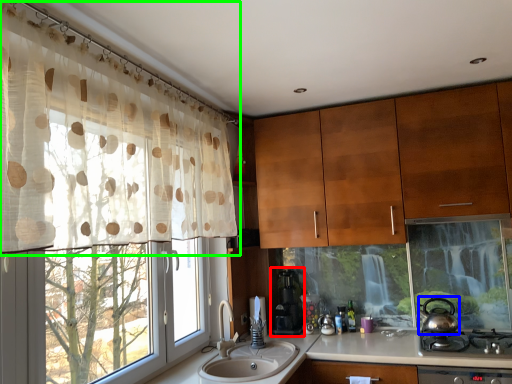
Question: Estimate the real-world distances between objects in this image. Which object is farther from coffee machine (highlighted by a red box), tea pot (highlighted by a blue box) or curtain (highlighted by a green box)?

Choices:
 (A) tea pot
 (B) curtain

Answer: (B)